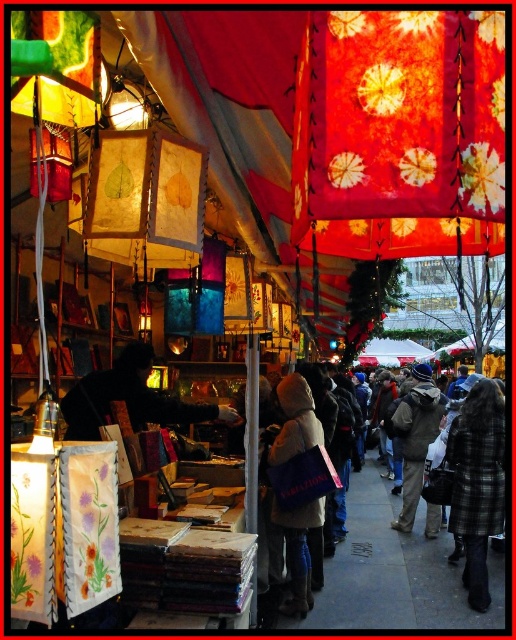
You are setting up a display in the market and need to place the handmade paper lantern at center and the black fabric at center. Which object requires more horizontal space for placement?

The black fabric at center requires more horizontal space since it has a greater width than the handmade paper lantern at center.